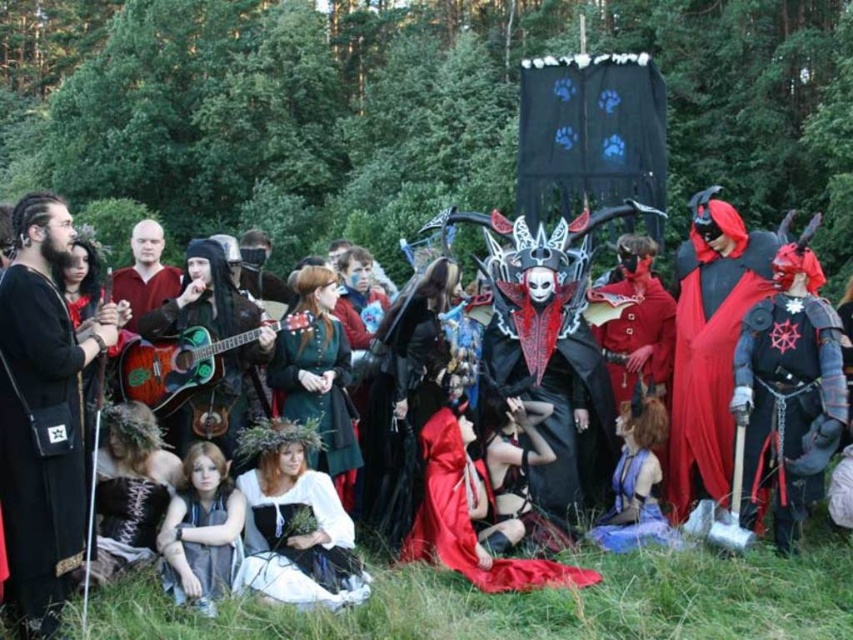
Question: Does metallic armor at center have a smaller size compared to velvet red dress at center?

Choices:
 (A) no
 (B) yes

Answer: (B)

Question: Considering the real-world distances, which object is closest to the metallic armor at center?

Choices:
 (A) velvet red dress at center
 (B) green matte guitar at center
 (C) smooth red shirt at center

Answer: (A)

Question: Does metallic armor at center have a lesser width compared to velvet red dress at center?

Choices:
 (A) no
 (B) yes

Answer: (B)

Question: Which of the following is the farthest from the observer?

Choices:
 (A) green matte guitar at center
 (B) matte black mask at center
 (C) matte gray dress at lower center

Answer: (A)

Question: Can you confirm if matte gray dress at lower center is thinner than green matte guitar at center?

Choices:
 (A) yes
 (B) no

Answer: (A)

Question: Which object appears closest to the camera in this image?

Choices:
 (A) smooth red shirt at center
 (B) matte gray dress at lower center

Answer: (B)